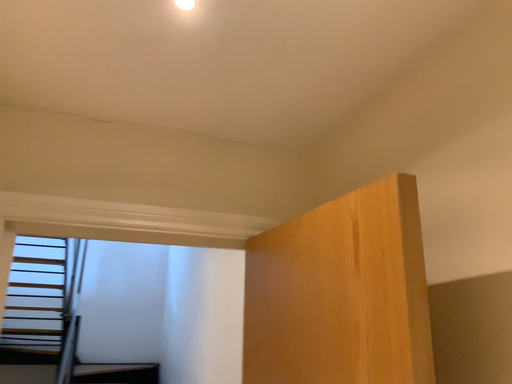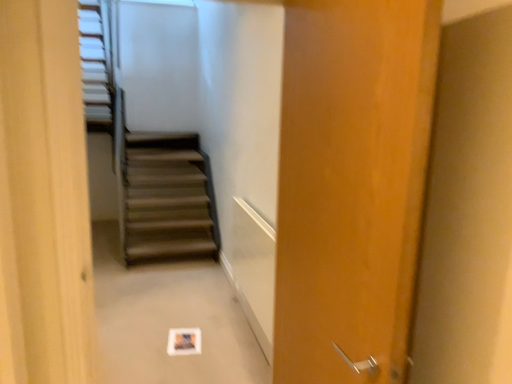
Question: Which way did the camera rotate in the video?

Choices:
 (A) rotated upward
 (B) rotated downward

Answer: (B)